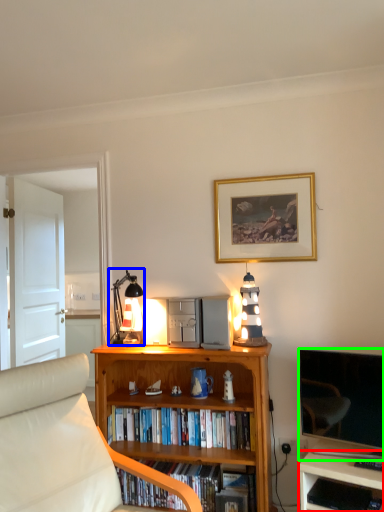
Question: Which object is the closest to the desk (highlighted by a red box)? Choose among these: table lamp (highlighted by a blue box) or television (highlighted by a green box).

Choices:
 (A) table lamp
 (B) television

Answer: (B)